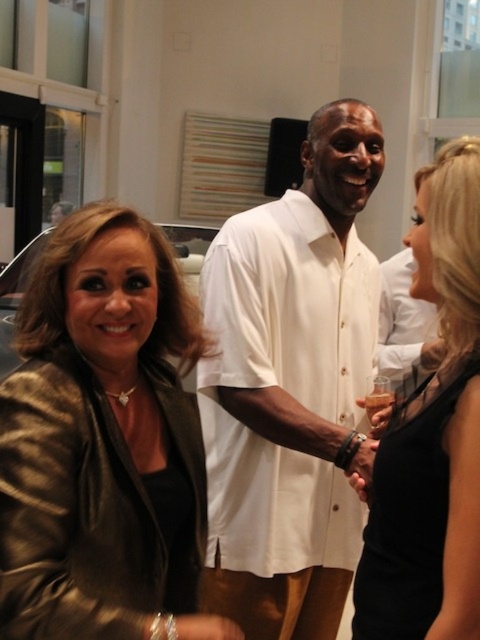
Question: Which of the following is the farthest from the observer?

Choices:
 (A) (196, 467)
 (B) (252, 436)
 (C) (422, 272)

Answer: (B)

Question: Which object appears farthest from the camera in this image?

Choices:
 (A) black satin dress at center
 (B) metallic gold jacket at center

Answer: (A)

Question: Is the position of metallic gold jacket at center more distant than that of black satin dress at center?

Choices:
 (A) no
 (B) yes

Answer: (A)

Question: In this image, where is white cotton shirt at center located relative to black satin dress at center?

Choices:
 (A) right
 (B) left

Answer: (B)

Question: Which of the following is the farthest from the observer?

Choices:
 (A) black satin dress at center
 (B) white cotton shirt at center
 (C) metallic gold jacket at center

Answer: (B)

Question: In this image, where is white cotton shirt at center located relative to black satin dress at center?

Choices:
 (A) left
 (B) right

Answer: (A)